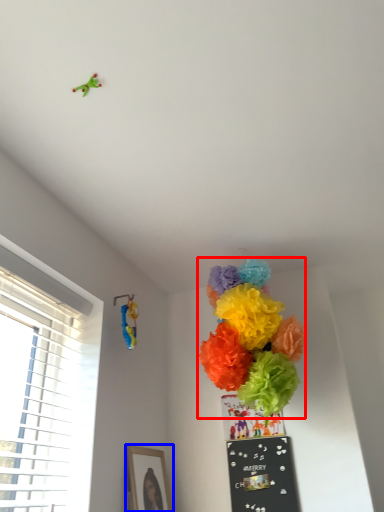
Question: Among these objects, which one is farthest to the camera, flower (highlighted by a red box) or picture frame (highlighted by a blue box)?

Choices:
 (A) flower
 (B) picture frame

Answer: (B)